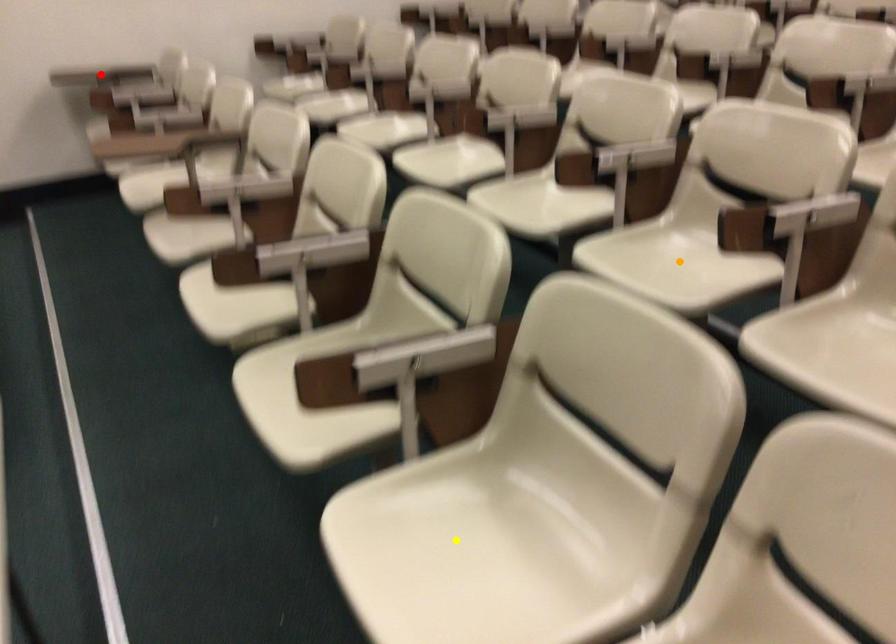
Order these from farthest to nearest:
A) red point
B) yellow point
C) orange point

red point
orange point
yellow point